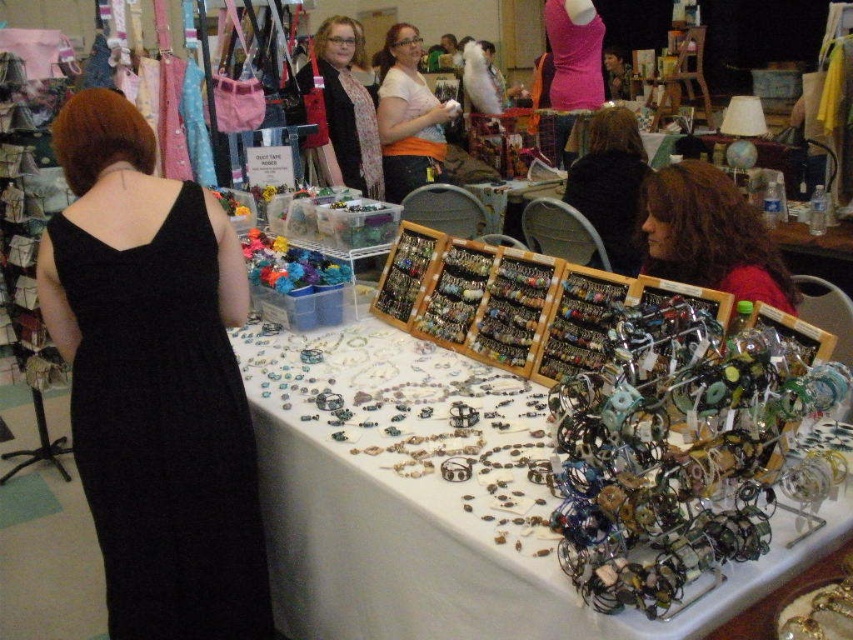
Between point (648, 449) and point (425, 113), which one is positioned in front?

Positioned in front is point (648, 449).

Does metallic wire bracelets at center have a greater width compared to white matte shirt at center?

In fact, metallic wire bracelets at center might be narrower than white matte shirt at center.

The height and width of the screenshot is (640, 853). In order to click on metallic wire bracelets at center in this screenshot , I will do `click(680, 452)`.

Based on the photo, can you confirm if shiny brown hair at center is positioned to the right of white matte shirt at center?

Yes, shiny brown hair at center is to the right of white matte shirt at center.

Image resolution: width=853 pixels, height=640 pixels. Describe the element at coordinates (711, 236) in the screenshot. I see `shiny brown hair at center` at that location.

Who is more forward, (755, 214) or (437, 118)?

Point (755, 214) is more forward.

I want to click on shiny brown hair at center, so click(x=711, y=236).

Between white fabric tablecloth at center and matte black scarf at center, which one is positioned higher?

matte black scarf at center

This screenshot has width=853, height=640. Describe the element at coordinates (444, 499) in the screenshot. I see `white fabric tablecloth at center` at that location.

Is point (344, 504) closer to viewer compared to point (332, 157)?

Yes.

Where is `white fabric tablecloth at center`? white fabric tablecloth at center is located at coordinates (444, 499).